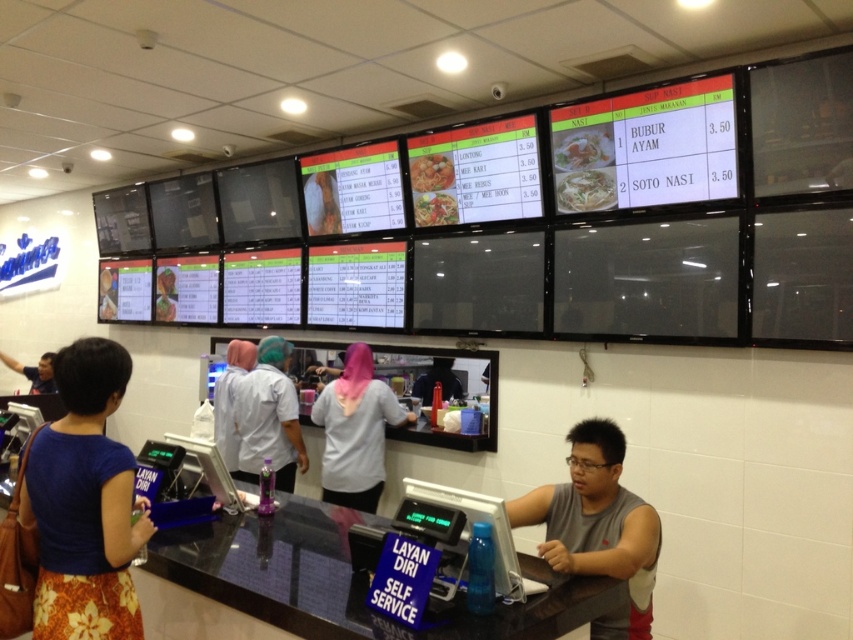
Question: Is shiny orange fried rice at center positioned before matte black shirt at upper left?

Choices:
 (A) no
 (B) yes

Answer: (B)

Question: Estimate the real-world distances between objects in this image. Which object is closer to the blue floral dress at lower left?

Choices:
 (A) white fabric uniform at center
 (B) shiny orange fried rice at center

Answer: (A)

Question: Which point is farther to the camera?

Choices:
 (A) white glossy rice bowl at center
 (B) white glossy noodles at center

Answer: (B)

Question: Is white glossy rice bowl at center smaller than shiny orange fried rice at center?

Choices:
 (A) no
 (B) yes

Answer: (B)

Question: Which point is farther to the camera?

Choices:
 (A) white uniform at center
 (B) white glossy rice bowl at center

Answer: (A)

Question: Does gray sleeveless shirt at lower right have a greater width compared to shiny plastic noodles at center?

Choices:
 (A) no
 (B) yes

Answer: (B)